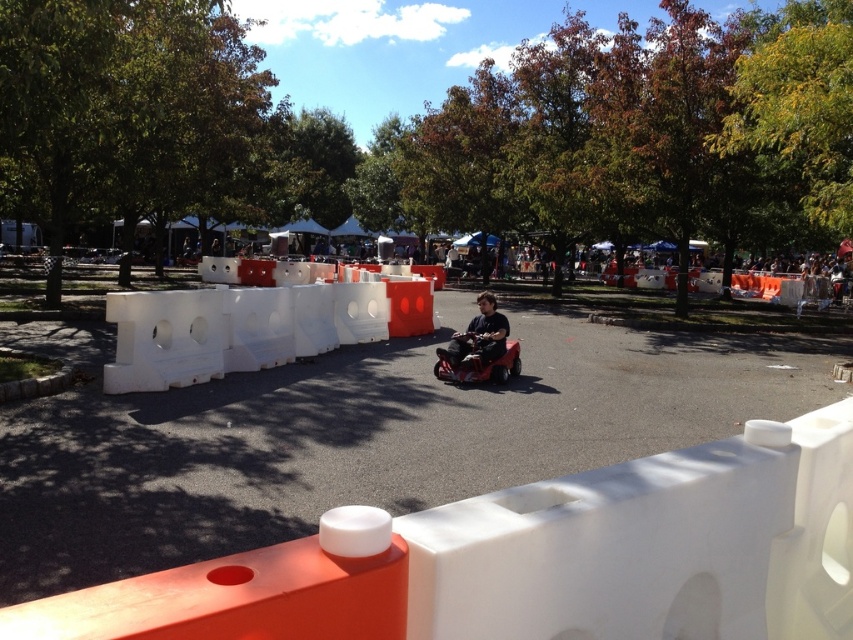
Between white plastic barrier at center and red plastic mobility scooter at center, which one is positioned lower?

red plastic mobility scooter at center

Find the location of a particular element. Image resolution: width=853 pixels, height=640 pixels. white plastic barrier at center is located at coordinates (247, 326).

Locate an element on the screen. white plastic barrier at center is located at coordinates (247, 326).

Who is taller, white plastic barrier at center or dark gray fabric jacket at center?

white plastic barrier at center is taller.

Between white plastic barrier at center and dark gray fabric jacket at center, which one is positioned higher?

white plastic barrier at center is higher up.

Describe the element at coordinates (247, 326) in the screenshot. I see `white plastic barrier at center` at that location.

Locate an element on the screen. white plastic barrier at center is located at coordinates (247, 326).

Does red plastic mobility scooter at center have a greater width compared to dark gray fabric jacket at center?

No.

Between point (447, 349) and point (467, 346), which one is positioned behind?

Point (467, 346)

Identify the location of red plastic mobility scooter at center. (477, 362).